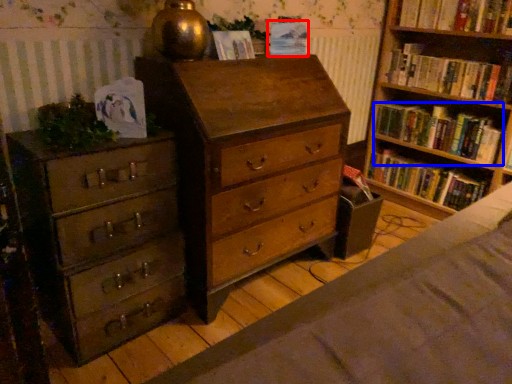
Question: Among these objects, which one is nearest to the camera, paperback book (highlighted by a red box) or book (highlighted by a blue box)?

Choices:
 (A) paperback book
 (B) book

Answer: (A)